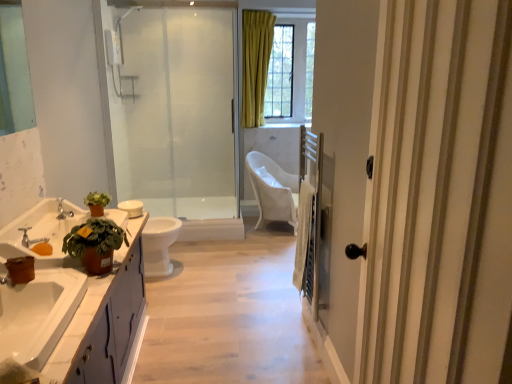
This screenshot has width=512, height=384. I want to click on free point to the right of white glossy cabinet at lower left, so (x=203, y=344).